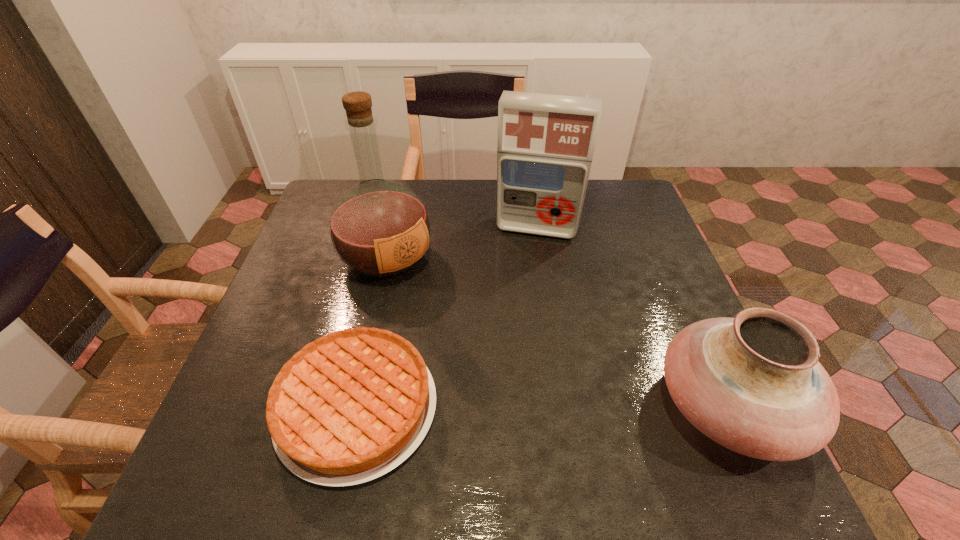
Find the location of a particular element. vacant area located on the front label of the liquor is located at coordinates (492, 356).

Where is `vacant region located 0.360m on the front-facing side of the third shortest object`? The width and height of the screenshot is (960, 540). vacant region located 0.360m on the front-facing side of the third shortest object is located at coordinates (510, 341).

Find the location of `free space located 0.350m on the front-facing side of the third shortest object`. free space located 0.350m on the front-facing side of the third shortest object is located at coordinates (510, 337).

The image size is (960, 540). Identify the location of vacant space located 0.200m on the front-facing side of the third shortest object. (519, 291).

Where is `object situated at the far edge`? object situated at the far edge is located at coordinates (545, 145).

Locate an element on the screen. pie located at the near edge is located at coordinates (349, 407).

Identify the location of pottery at the near edge. This screenshot has height=540, width=960. (753, 383).

Locate an element on the screen. pie situated at the left edge is located at coordinates (349, 407).

Where is `liquor located in the left edge section of the desktop`? The width and height of the screenshot is (960, 540). liquor located in the left edge section of the desktop is located at coordinates (379, 228).

I want to click on object at the right edge, so click(753, 383).